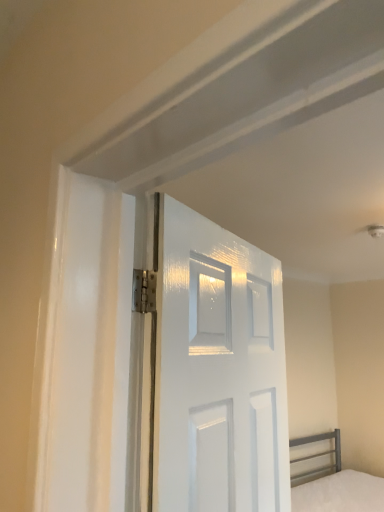
Image resolution: width=384 pixels, height=512 pixels. Find the location of `white matte bed at lower right`. white matte bed at lower right is located at coordinates click(x=335, y=484).

What do you see at coordinates (335, 484) in the screenshot? The height and width of the screenshot is (512, 384). I see `white matte bed at lower right` at bounding box center [335, 484].

Locate an element on the screen. white glossy door at center is located at coordinates (219, 370).

What do you see at coordinates (219, 370) in the screenshot?
I see `white glossy door at center` at bounding box center [219, 370].

What is the approximate height of white glossy door at center?

It is 32.21 inches.

Identify the location of white matte bed at lower right. pyautogui.click(x=335, y=484).

Is white glossy door at center at the right side of white matte bed at lower right?

No.

Looking at this image, is white glossy door at center further to the viewer compared to white matte bed at lower right?

No, it is in front of white matte bed at lower right.

Between point (236, 462) and point (348, 507), which one is positioned in front?

The point (236, 462) is more forward.

From the image's perspective, which one is positioned lower, white glossy door at center or white matte bed at lower right?

white matte bed at lower right is shown below in the image.

From a real-world perspective, which is physically above, white glossy door at center or white matte bed at lower right?

white glossy door at center.

Is white glossy door at center thinner than white matte bed at lower right?

Correct, the width of white glossy door at center is less than that of white matte bed at lower right.

Is white glossy door at center shorter than white matte bed at lower right?

Incorrect, the height of white glossy door at center does not fall short of that of white matte bed at lower right.

Is white glossy door at center bigger than white matte bed at lower right?

No, white glossy door at center is not bigger than white matte bed at lower right.

Is white glossy door at center situated inside white matte bed at lower right or outside?

The correct answer is: outside.

Is white glossy door at center placed right next to white matte bed at lower right?

No, white glossy door at center is not with white matte bed at lower right.

Looking at this image, is white glossy door at center oriented away from white matte bed at lower right?

No.

How different are the orientations of white glossy door at center and white matte bed at lower right in degrees?

The angular difference between white glossy door at center and white matte bed at lower right is 19.5 degrees.

Locate an element on the screen. The width and height of the screenshot is (384, 512). bed to the right of white glossy door at center is located at coordinates (335, 484).

Considering the relative positions of white matte bed at lower right and white glossy door at center in the image provided, is white matte bed at lower right to the right of white glossy door at center from the viewer's perspective?

Indeed, white matte bed at lower right is positioned on the right side of white glossy door at center.

From the picture: Is white matte bed at lower right positioned in front of white glossy door at center?

No, white matte bed at lower right is behind white glossy door at center.

Is point (329, 434) closer or farther from the camera than point (181, 420)?

Point (329, 434) is farther from the camera than point (181, 420).

From the image's perspective, who appears lower, white matte bed at lower right or white glossy door at center?

white matte bed at lower right.

From a real-world perspective, is white matte bed at lower right physically located above or below white glossy door at center?

In terms of real-world spatial position, white matte bed at lower right is below white glossy door at center.

Which object is thinner, white matte bed at lower right or white glossy door at center?

Thinner between the two is white glossy door at center.

Who is shorter, white matte bed at lower right or white glossy door at center?

With less height is white matte bed at lower right.

Does white matte bed at lower right have a smaller size compared to white glossy door at center?

Incorrect, white matte bed at lower right is not smaller in size than white glossy door at center.

Do you think white matte bed at lower right is within white glossy door at center, or outside of it?

white matte bed at lower right is not inside white glossy door at center, it's outside.

From the picture: Are white matte bed at lower right and white glossy door at center beside each other?

No.

Is white matte bed at lower right positioned with its back to white glossy door at center?

No, white matte bed at lower right is not facing away from white glossy door at center.

How different are the orientations of white matte bed at lower right and white glossy door at center in degrees?

The facing directions of white matte bed at lower right and white glossy door at center are 19.5 degrees apart.

What are the coordinates of `door that is above the white matte bed at lower right (from the image's perspective)` in the screenshot? It's located at (219, 370).

At what (x,y) coordinates should I click in order to perform the action: click on door above the white matte bed at lower right (from a real-world perspective). Please return your answer as a coordinate pair (x, y). This screenshot has height=512, width=384. Looking at the image, I should click on (219, 370).

At what (x,y) coordinates should I click in order to perform the action: click on door on the left side of white matte bed at lower right. Please return your answer as a coordinate pair (x, y). The width and height of the screenshot is (384, 512). Looking at the image, I should click on (219, 370).